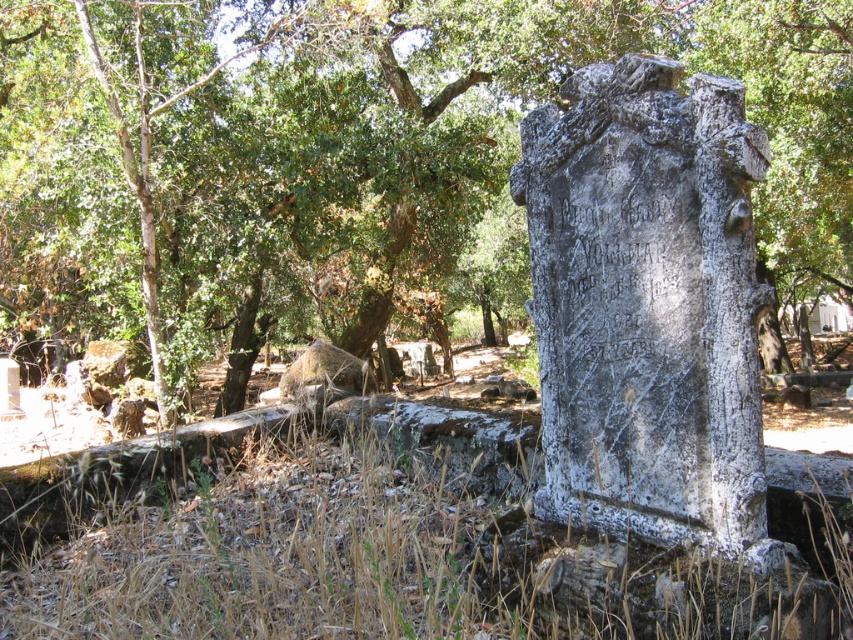
You are a gardener standing at the edge of the cemetery. You see the green leafy tree at center and the dry grass at lower center. Which object is directly above the other?

The green leafy tree at center is positioned over dry grass at lower center.

You are standing in the old cemetery and want to take a photo of both point (593,138) and point (212,625). Which point should you focus on first to ensure both are in sharp focus?

You should focus on point (593,138) first because it is further away from the camera than point (212,625), ensuring the depth of field captures both points clearly.

You are standing at the entrance of the cemetery and see the white stone pillar at center. If you walk straight ahead, will you reach the pillar before the dense forest in the background?

The white stone pillar at center is located at point (646, 304), which is closer to the entrance than the dense forest in the background, so yes, you will reach the pillar before the forest.